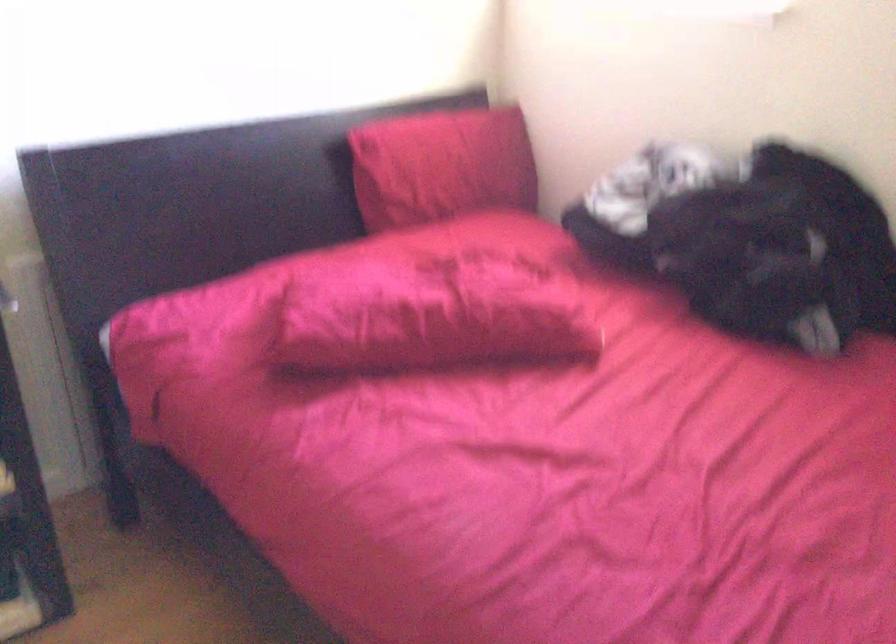
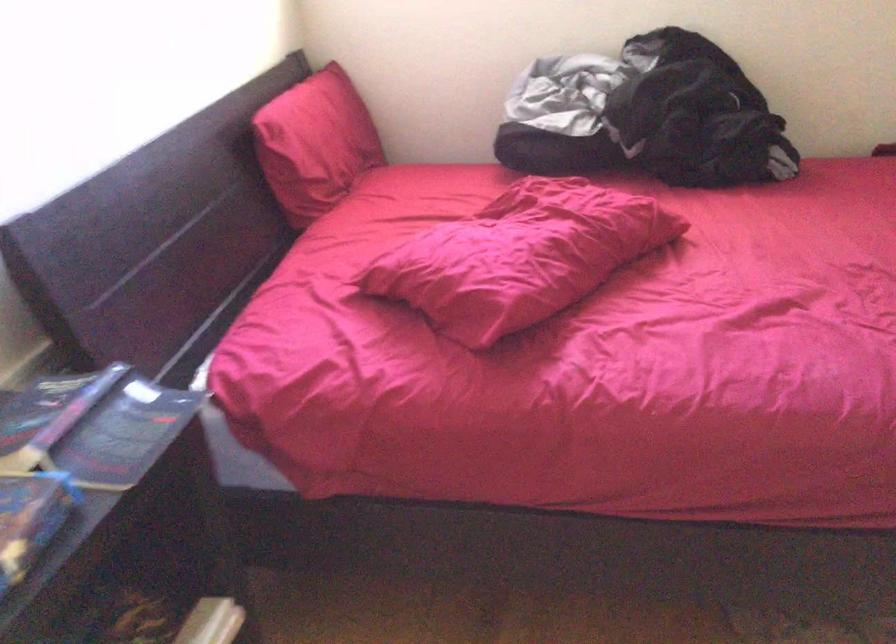
Where in the second image is the point corresponding to point 405,164 from the first image?

(314, 144)